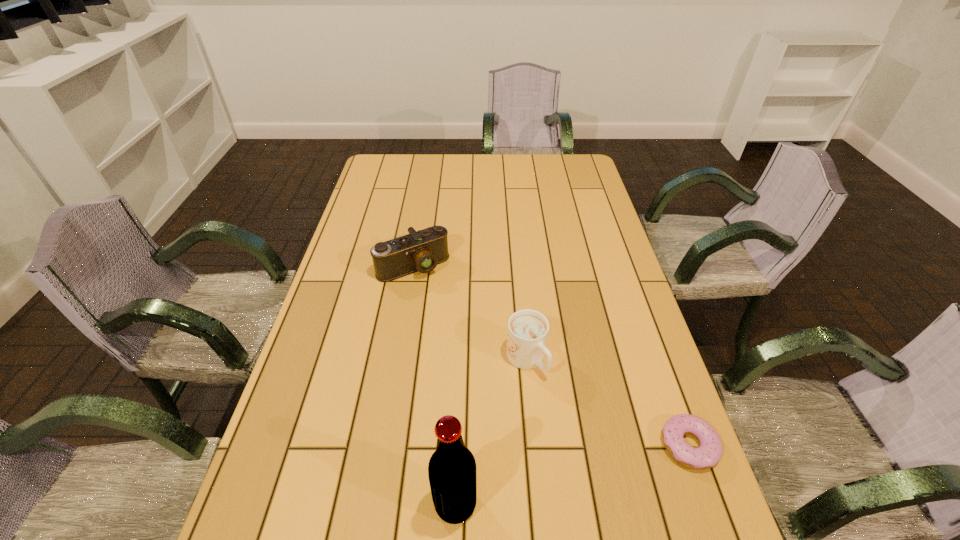
In order to click on free space that is in between the third object from left to right and the farthest object in this screenshot , I will do `click(469, 313)`.

The width and height of the screenshot is (960, 540). I want to click on vacant point located between the beer bottle and the third nearest object, so click(x=491, y=432).

This screenshot has width=960, height=540. Identify the location of object that stands as the second closest to the third farthest object. (452, 467).

Identify which object is located as the third nearest to the third farthest object. Please provide its 2D coordinates. Your answer should be formatted as a tuple, i.e. [(x, y)], where the tuple contains the x and y coordinates of a point satisfying the conditions above.

[(422, 250)]

Identify the location of free space that satisfies the following two spatial constraints: 1. on the back side of the third object from right to left; 2. on the right side of the cappuccino. The height and width of the screenshot is (540, 960). (461, 360).

Find the location of `vacant point that satisfies the following two spatial constraints: 1. on the front side of the third nearest object; 2. on the left side of the third farthest object`. vacant point that satisfies the following two spatial constraints: 1. on the front side of the third nearest object; 2. on the left side of the third farthest object is located at coordinates (535, 445).

Where is `free space in the image that satisfies the following two spatial constraints: 1. on the back side of the shortest object; 2. on the right side of the beer bottle`? Image resolution: width=960 pixels, height=540 pixels. free space in the image that satisfies the following two spatial constraints: 1. on the back side of the shortest object; 2. on the right side of the beer bottle is located at coordinates (458, 445).